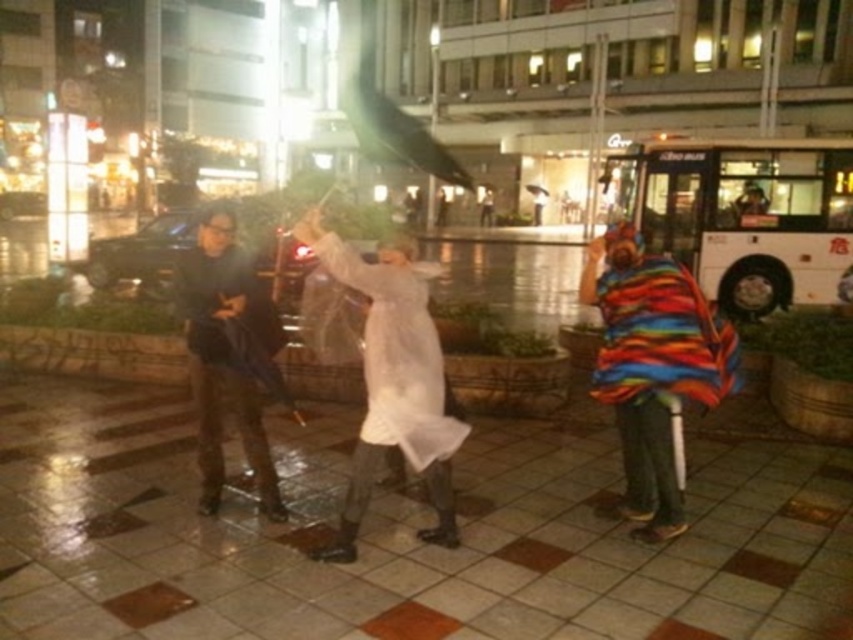
You are a photographer setting up a shot in the described nighttime urban scene. You need to position a spotlight so that it illuminates both the white translucent coat at center and the dark blue fabric jacket at center without overlapping their lit areas. Given their positions and sizes, is this possible?

The white translucent coat at center might be wider than dark blue fabric jacket at center, so it may be challenging to position the spotlight to illuminate both without overlapping their lit areas. Adjust the angle or use multiple spotlights for better coverage.

You are a photographer trying to capture a candid shot of the two people in the scene. The camera you are using has a maximum focus range of 25 inches. Can you get both the white translucent coat at center and the dark blue fabric jacket at center in focus without adjusting your position?

The distance between the white translucent coat at center and the dark blue fabric jacket at center is 26.27 inches, which exceeds the camera maximum focus range of 25 inches. Therefore, you cannot capture both in focus without adjusting your position.

You are a photographer trying to capture the scene from the same angle. You notice the white translucent coat at center and the dark blue fabric jacket at center. Which clothing item appears shorter in your photo?

The white translucent coat at center appears shorter in your photo because it has a lesser height compared to the dark blue fabric jacket at center.